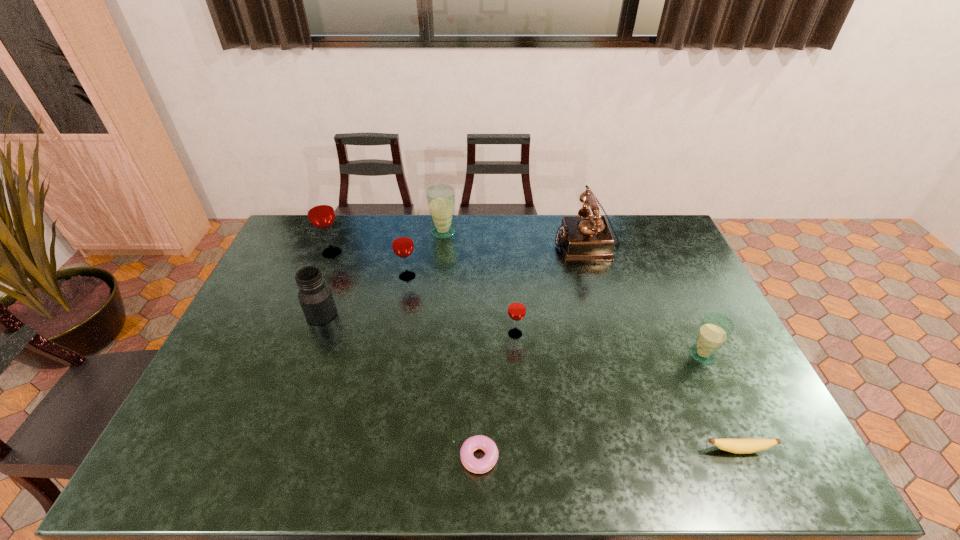
Locate an element on the screen. This screenshot has width=960, height=540. free space at the far right corner of the desktop is located at coordinates (640, 234).

Find the location of a particular element. This screenshot has width=960, height=540. blank region between the smallest red glass and the brown telephone is located at coordinates (551, 288).

Find the location of a particular element. The width and height of the screenshot is (960, 540). blank region between the fifth object from right to left and the second nearest glass is located at coordinates (495, 396).

The width and height of the screenshot is (960, 540). Identify the location of vacant space in between the leftmost glass and the fourth glass from right to left. (370, 264).

Image resolution: width=960 pixels, height=540 pixels. I want to click on vacant area that lies between the purple doughnut and the nearer blue glass, so click(588, 407).

Where is `free spot between the rightmost glass and the fourth object from left to right`? free spot between the rightmost glass and the fourth object from left to right is located at coordinates (573, 294).

I want to click on blank region between the banana and the bigger blue glass, so click(x=591, y=341).

Image resolution: width=960 pixels, height=540 pixels. I want to click on vacant region between the second nearest red glass and the leftmost red glass, so click(x=370, y=264).

At what (x,y) coordinates should I click in order to perform the action: click on free spot between the second glass from left to right and the second shortest object. Please return your answer as a coordinate pair (x, y). Image resolution: width=960 pixels, height=540 pixels. Looking at the image, I should click on (573, 363).

You are a GUI agent. You are given a task and a screenshot of the screen. Output one action in this format:
    pyautogui.click(x=<x>, y=<y>)
    Task: Click on the vacant point located between the rightmost glass and the third farthest glass
    This screenshot has width=960, height=540.
    Given the screenshot: What is the action you would take?
    pyautogui.click(x=555, y=315)